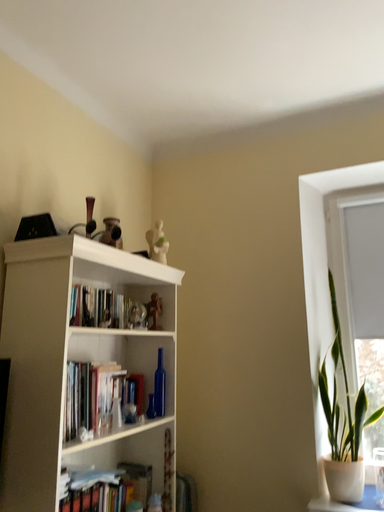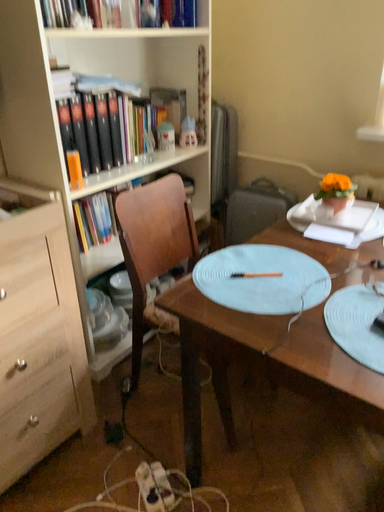
Question: Which way did the camera rotate in the video?

Choices:
 (A) rotated left
 (B) rotated right

Answer: (A)